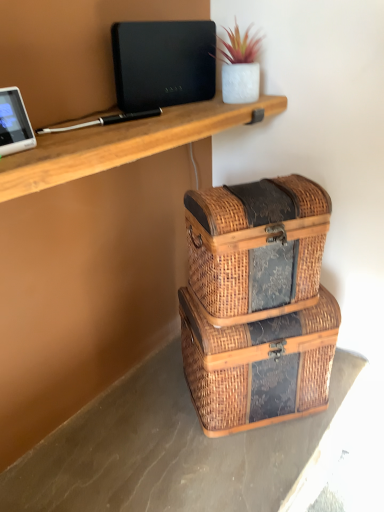
Question: Is woven wood trunk at center, the first storage box in the top-to-bottom sequence, beside woven wood storage box at lower center, the 2th storage box positioned from the top?

Choices:
 (A) yes
 (B) no

Answer: (B)

Question: Is woven wood trunk at center, the first storage box in the top-to-bottom sequence, turned away from woven wood storage box at lower center, the 2th storage box positioned from the top?

Choices:
 (A) yes
 (B) no

Answer: (B)

Question: Is woven wood trunk at center, arranged as the second storage box when ordered from the bottom, bigger than woven wood storage box at lower center, the 1th storage box ordered from the bottom?

Choices:
 (A) yes
 (B) no

Answer: (B)

Question: From the image's perspective, is woven wood trunk at center, the first storage box in the top-to-bottom sequence, under woven wood storage box at lower center, the 2th storage box positioned from the top?

Choices:
 (A) no
 (B) yes

Answer: (A)

Question: Does woven wood trunk at center, arranged as the second storage box when ordered from the bottom, have a greater width compared to woven wood storage box at lower center, the 2th storage box positioned from the top?

Choices:
 (A) no
 (B) yes

Answer: (A)

Question: Would you say white glossy tablet at upper left is inside or outside black matte laptop at upper center?

Choices:
 (A) outside
 (B) inside

Answer: (A)

Question: Looking at their shapes, would you say white glossy tablet at upper left is wider or thinner than black matte laptop at upper center?

Choices:
 (A) thin
 (B) wide

Answer: (B)

Question: Considering the relative positions of white glossy tablet at upper left and black matte laptop at upper center in the image provided, is white glossy tablet at upper left to the left or to the right of black matte laptop at upper center?

Choices:
 (A) right
 (B) left

Answer: (B)

Question: From a real-world perspective, is white glossy tablet at upper left above or below black matte laptop at upper center?

Choices:
 (A) above
 (B) below

Answer: (B)

Question: Is woven wood trunk at center, arranged as the second storage box when ordered from the bottom, inside or outside of white glossy tablet at upper left?

Choices:
 (A) outside
 (B) inside

Answer: (A)

Question: Is woven wood trunk at center, the first storage box in the top-to-bottom sequence, to the left or to the right of white glossy tablet at upper left in the image?

Choices:
 (A) right
 (B) left

Answer: (A)

Question: Considering the positions of point (225, 267) and point (13, 119), is point (225, 267) closer or farther from the camera than point (13, 119)?

Choices:
 (A) farther
 (B) closer

Answer: (A)

Question: From a real-world perspective, is woven wood trunk at center, arranged as the second storage box when ordered from the bottom, physically located above or below white glossy tablet at upper left?

Choices:
 (A) above
 (B) below

Answer: (B)

Question: Looking at their shapes, would you say brown wicker baskets at lower right is wider or thinner than black matte laptop at upper center?

Choices:
 (A) wide
 (B) thin

Answer: (A)

Question: Visually, is brown wicker baskets at lower right positioned to the left or to the right of black matte laptop at upper center?

Choices:
 (A) left
 (B) right

Answer: (B)